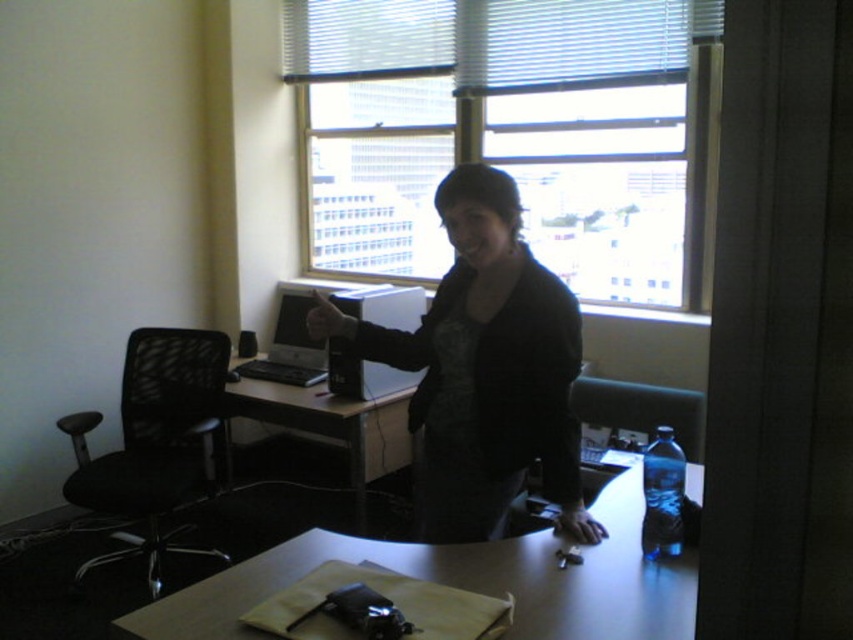
Question: Considering the real-world distances, which object is farthest from the black matte shirt at center?

Choices:
 (A) silver metallic laptop at center
 (B) matte black monitor at center
 (C) transparent glass window at upper center
 (D) matte black desktop computer at center

Answer: (C)

Question: Does silver metallic laptop at center appear under matte black monitor at center?

Choices:
 (A) no
 (B) yes

Answer: (B)

Question: Does transparent glass window at upper center appear under matte black monitor at center?

Choices:
 (A) yes
 (B) no

Answer: (B)

Question: Is white glossy computer desk at center further to the viewer compared to matte black desktop computer at center?

Choices:
 (A) yes
 (B) no

Answer: (B)

Question: Considering the real-world distances, which object is closest to the silver metallic laptop at center?

Choices:
 (A) matte black desk at center
 (B) matte black desktop computer at center
 (C) black matte shirt at center

Answer: (A)

Question: Which object is positioned farthest from the matte black monitor at center?

Choices:
 (A) silver metallic laptop at center
 (B) white glossy computer desk at center

Answer: (B)